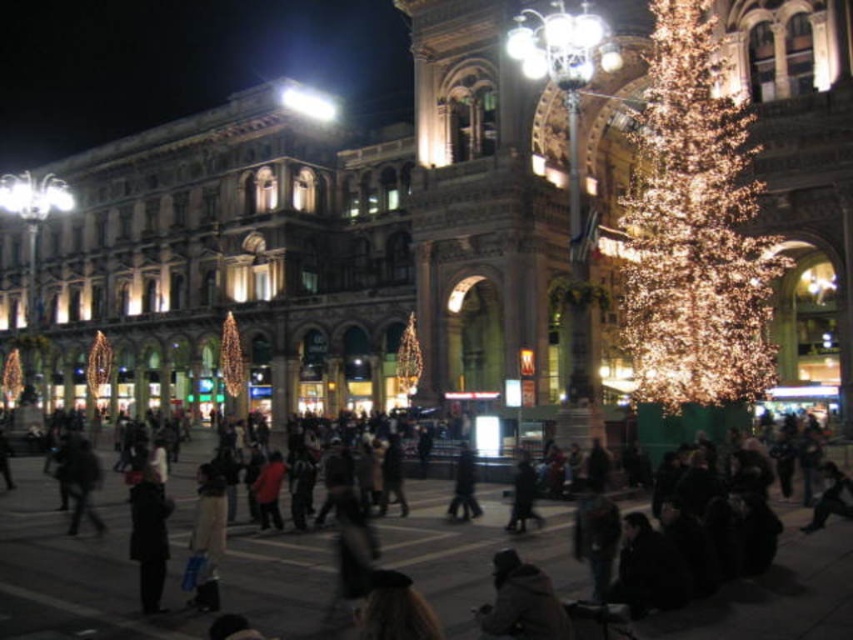
Question: Which point appears farthest from the camera in this image?

Choices:
 (A) (419, 508)
 (B) (135, 486)
 (C) (651, 376)

Answer: (C)

Question: Which object appears farthest from the camera in this image?

Choices:
 (A) illuminated gold tree at right
 (B) dark gray coat at lower left

Answer: (A)

Question: Which object appears farthest from the camera in this image?

Choices:
 (A) illuminated gold tree at right
 (B) dark gray coat at lower center

Answer: (A)

Question: Is illuminated gold tree at right positioned before dark gray coat at lower left?

Choices:
 (A) no
 (B) yes

Answer: (A)

Question: Is illuminated gold tree at right smaller than dark gray coat at lower left?

Choices:
 (A) no
 (B) yes

Answer: (A)

Question: Is dark clothing crowd at center thinner than dark gray coat at lower left?

Choices:
 (A) no
 (B) yes

Answer: (A)